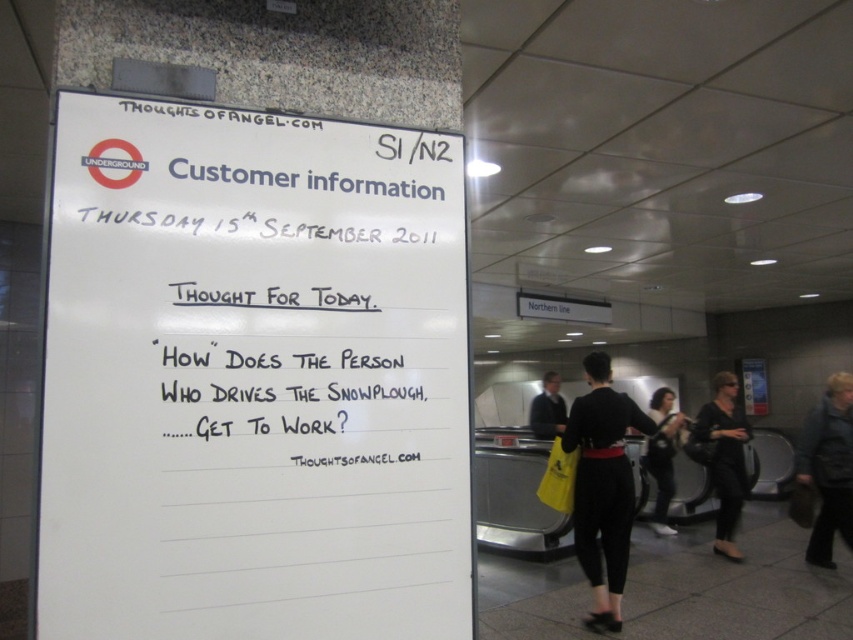
Question: Considering the real-world distances, which object is farthest from the white paperboard at upper left?

Choices:
 (A) black leather jacket at right
 (B) black leather jacket at lower right
 (C) dark gray suit at center
 (D) black fabric dress at lower right

Answer: (C)

Question: Does black fabric dress at lower right appear on the right side of black leather jacket at right?

Choices:
 (A) yes
 (B) no

Answer: (A)

Question: Is black fabric pants at lower center positioned behind dark gray suit at center?

Choices:
 (A) yes
 (B) no

Answer: (B)

Question: Which of the following is the closest to the observer?

Choices:
 (A) black fabric pants at lower center
 (B) white paperboard at upper left

Answer: (B)

Question: Is black fabric pants at lower center wider than black fabric dress at lower right?

Choices:
 (A) no
 (B) yes

Answer: (A)

Question: Among these points, which one is farthest from the camera?

Choices:
 (A) (664, 419)
 (B) (543, 387)
 (C) (373, 298)

Answer: (B)